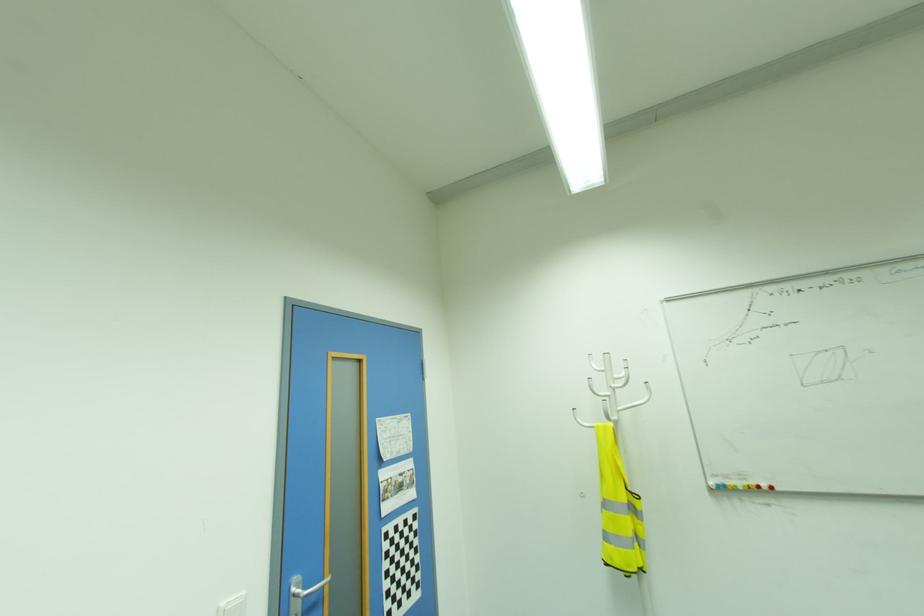
Find where to pull the metal door handle. Please return your answer as a coordinate pair (x, y).

(309, 589)